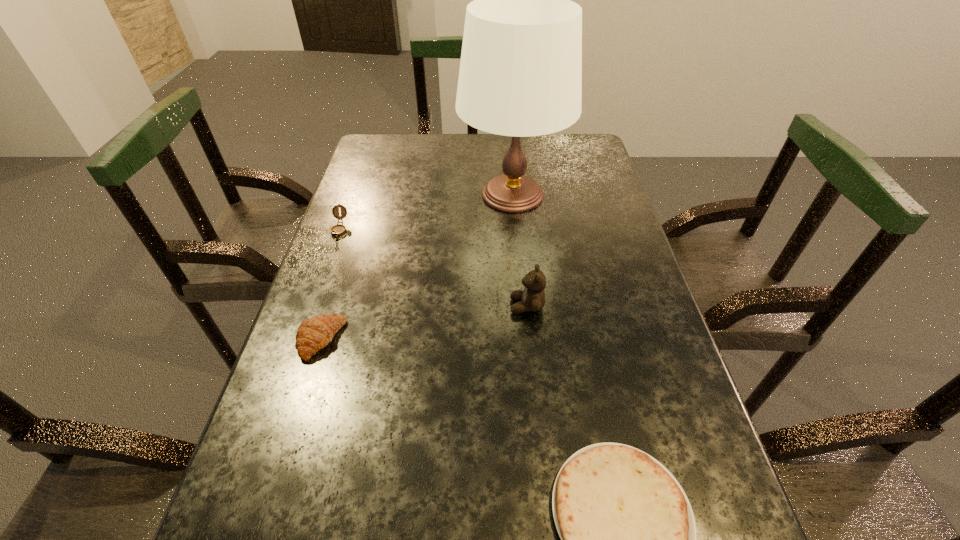
The width and height of the screenshot is (960, 540). I want to click on blank region between the teddy bear and the compass, so click(433, 268).

Identify the location of empty location between the second tallest object and the crescent roll. This screenshot has height=540, width=960. (424, 323).

Locate an element on the screen. vacant space that's between the tallest object and the compass is located at coordinates (426, 212).

Image resolution: width=960 pixels, height=540 pixels. Find the location of `empty location between the teddy bear and the tallest object`. empty location between the teddy bear and the tallest object is located at coordinates (519, 251).

Where is `unoccupied area between the teddy bear and the compass`? Image resolution: width=960 pixels, height=540 pixels. unoccupied area between the teddy bear and the compass is located at coordinates (433, 268).

Select which object appears as the second closest to the tortilla. Please provide its 2D coordinates. Your answer should be formatted as a tuple, i.e. [(x, y)], where the tuple contains the x and y coordinates of a point satisfying the conditions above.

[(313, 334)]

Select which object appears as the fourth closest to the lamp. Please provide its 2D coordinates. Your answer should be formatted as a tuple, i.e. [(x, y)], where the tuple contains the x and y coordinates of a point satisfying the conditions above.

[(628, 536)]

You are a GUI agent. You are given a task and a screenshot of the screen. Output one action in this format:
    pyautogui.click(x=<x>, y=<y>)
    Task: Click on the blank area in the image that satisfies the following two spatial constraints: 1. on the face of the compass; 2. on the right side of the crescent roll
    This screenshot has height=540, width=960.
    Given the screenshot: What is the action you would take?
    pyautogui.click(x=300, y=340)

The image size is (960, 540). Find the location of `free space that satisfies the following two spatial constraints: 1. on the face of the compass; 2. on the left side of the crescent roll`. free space that satisfies the following two spatial constraints: 1. on the face of the compass; 2. on the left side of the crescent roll is located at coordinates (300, 340).